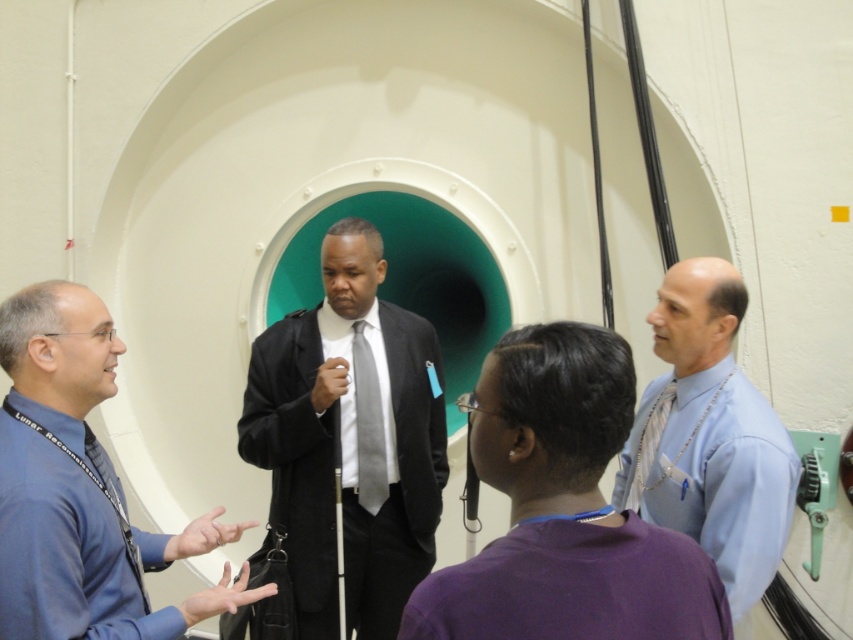
Question: Is light blue shirt at center positioned before silver metallic tie at center?

Choices:
 (A) yes
 (B) no

Answer: (A)

Question: Can you confirm if matte black suit at center is positioned to the left of gray satin tie at center?

Choices:
 (A) no
 (B) yes

Answer: (B)

Question: Which point is closer to the camera?

Choices:
 (A) matte black suit at center
 (B) silver metallic tie at center
 (C) light blue shirt at center

Answer: (C)

Question: Which point is farther to the camera?

Choices:
 (A) (287, 508)
 (B) (631, 492)
 (C) (354, 381)

Answer: (C)

Question: Which point is farther from the camera taking this photo?

Choices:
 (A) (703, 308)
 (B) (657, 436)
 (C) (376, 429)
 (D) (375, 387)

Answer: (D)

Question: Is matte black suit at center further to the viewer compared to gray satin tie at center?

Choices:
 (A) no
 (B) yes

Answer: (A)